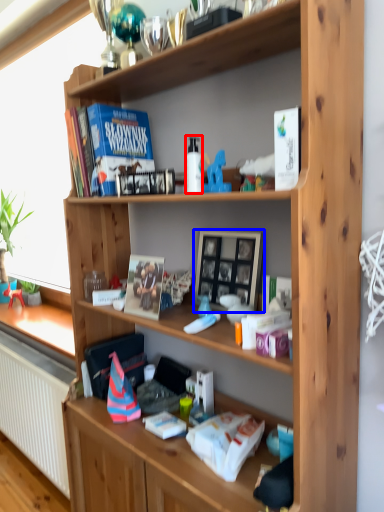
Question: Among these objects, which one is nearest to the camera, bottle (highlighted by a red box) or picture frame (highlighted by a blue box)?

Choices:
 (A) bottle
 (B) picture frame

Answer: (A)